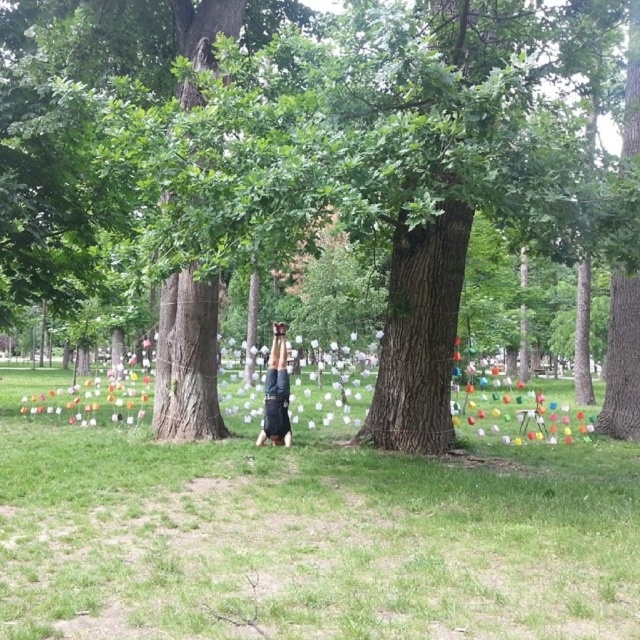
You are a photographer trying to capture the black fabric person at center in a photo. You want to ensure the green grass at center is visible to the left of the person. Based on the scene description, is this possible?

Yes, the green grass at center is positioned on the left side of black fabric person at center, so it will be visible to the left in the photo.

You are a park visitor who wants to walk from the point at coordinates point (108, 604) to the other side of the park. The park has a rule that you must stay at least 10 feet away from any tree trunk. Given that the distance between the two trees is 12.25 feet, can you safely walk between them without violating the park rules?

The two trees are 12.25 feet apart, and the park requires staying at least 10 feet away from any tree trunk. Since the distance between the trees is greater than the required safety distance, you can safely walk between them while maintaining the required distance from both tree trunks.

You are standing in the park and want to take a photo of the green rough bark tree at center. If your camera has a maximum focus distance of 16 feet, will you be able to focus on the tree?

The distance between you and the green rough bark tree at center is 15.98 feet, which is within the camera maximum focus distance of 16 feet. Therefore, you can focus on the tree.